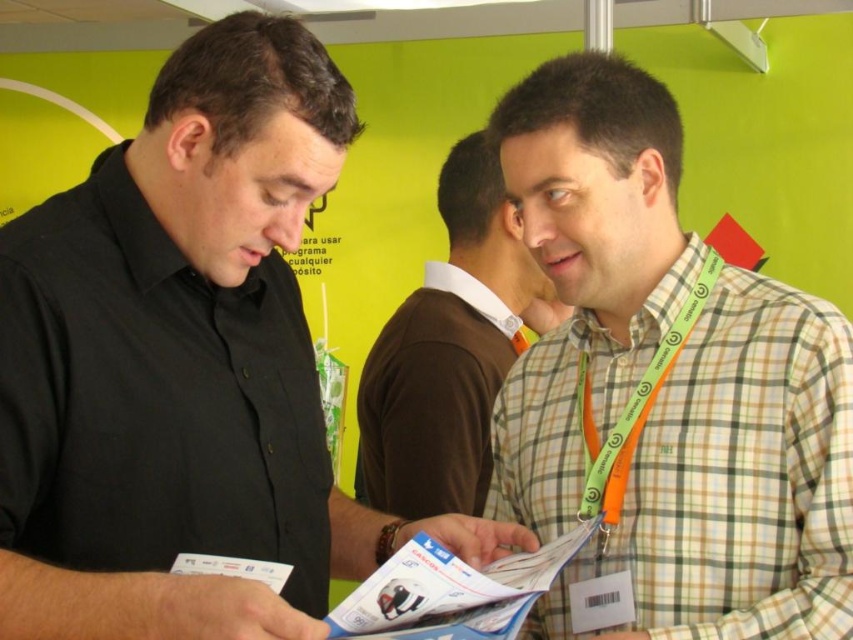
Question: Can you confirm if green plaid shirt at center is smaller than plaid fabric shirt at center?

Choices:
 (A) yes
 (B) no

Answer: (A)

Question: Can you confirm if black shirt at left is positioned above plaid fabric shirt at center?

Choices:
 (A) no
 (B) yes

Answer: (B)

Question: Among these objects, which one is farthest from the camera?

Choices:
 (A) orange fabric lanyard at right
 (B) green plaid shirt at center
 (C) plaid fabric shirt at center
 (D) black shirt at left

Answer: (C)

Question: Which is farther from the black shirt at left?

Choices:
 (A) green plaid shirt at center
 (B) orange fabric lanyard at right

Answer: (B)

Question: Which object appears closest to the camera in this image?

Choices:
 (A) plaid fabric shirt at center
 (B) green plaid shirt at center
 (C) black shirt at left

Answer: (C)

Question: Is black shirt at left smaller than plaid fabric shirt at center?

Choices:
 (A) no
 (B) yes

Answer: (A)